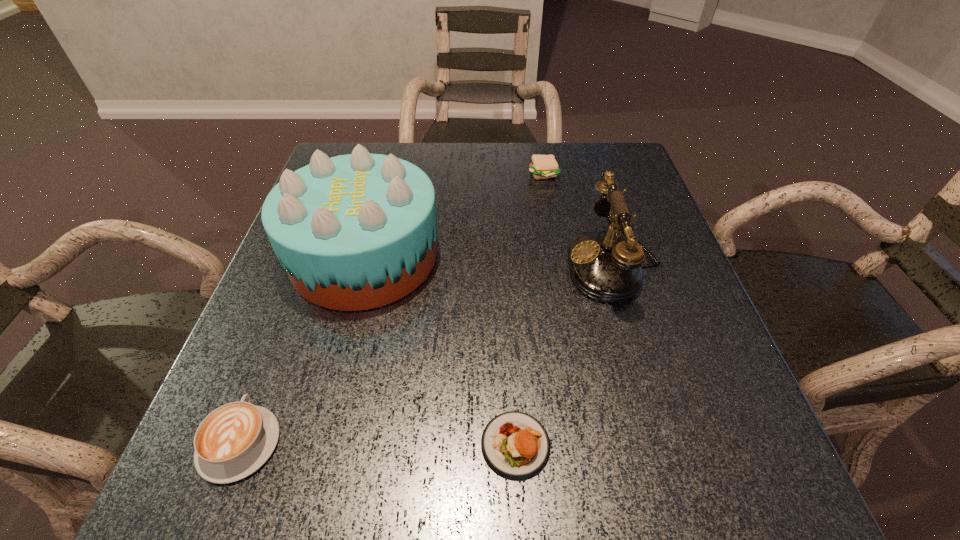
Image resolution: width=960 pixels, height=540 pixels. I want to click on cake, so click(x=354, y=232).

Where is `telephone`? The height and width of the screenshot is (540, 960). telephone is located at coordinates (605, 266).

Identify the location of the farthest object. (542, 166).

Locate an element on the screen. The image size is (960, 540). the taller patty (food) is located at coordinates (542, 166).

Locate an element on the screen. The image size is (960, 540). cappuccino is located at coordinates (233, 441).

Locate an element on the screen. The height and width of the screenshot is (540, 960). the left patty (food) is located at coordinates (515, 445).

Locate an element on the screen. This screenshot has height=540, width=960. the shorter patty (food) is located at coordinates (515, 445).

Image resolution: width=960 pixels, height=540 pixels. In order to click on vacant space located 0.300m on the right of the cake in this screenshot , I will do `click(581, 256)`.

Locate an element on the screen. The height and width of the screenshot is (540, 960). free space located 0.190m on the dial of the telephone is located at coordinates (476, 264).

Image resolution: width=960 pixels, height=540 pixels. I want to click on vacant space positioned on the dial of the telephone, so click(x=495, y=264).